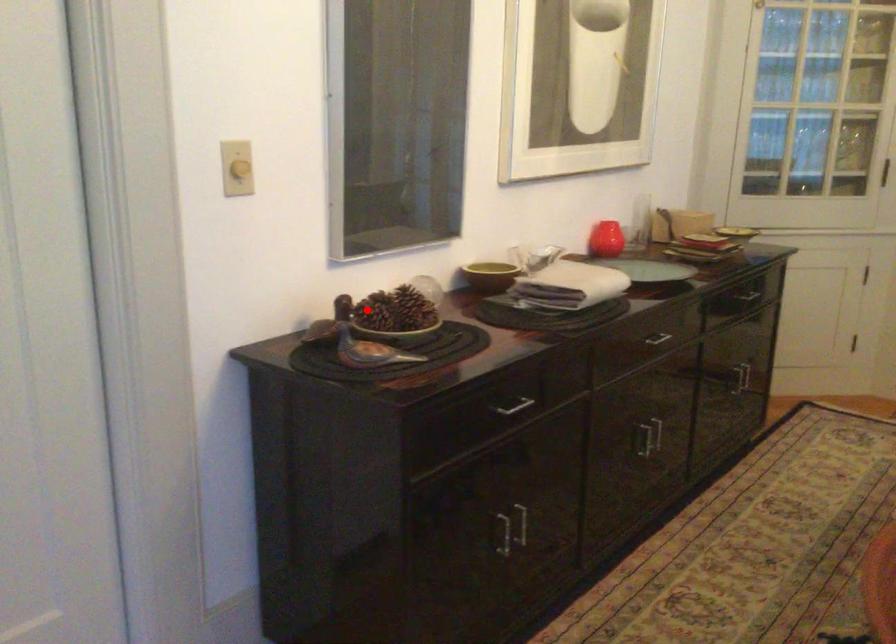
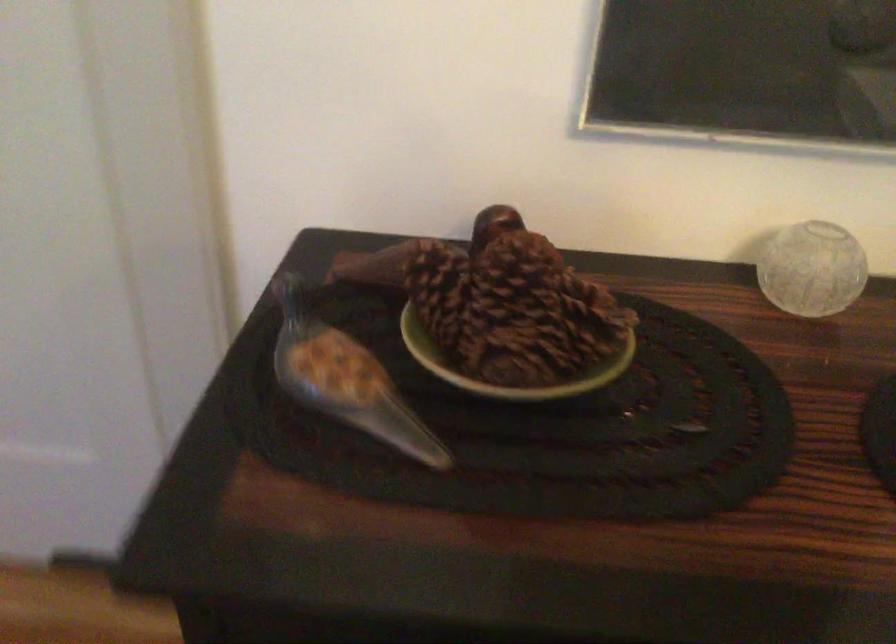
Question: I am providing you with two images of the same scene from different viewpoints. Image1 has a red point marked. In image2, the corresponding 3D location appears at what relative position? Reply with the corresponding letter.

Choices:
 (A) Closer
 (B) Farther

Answer: (A)